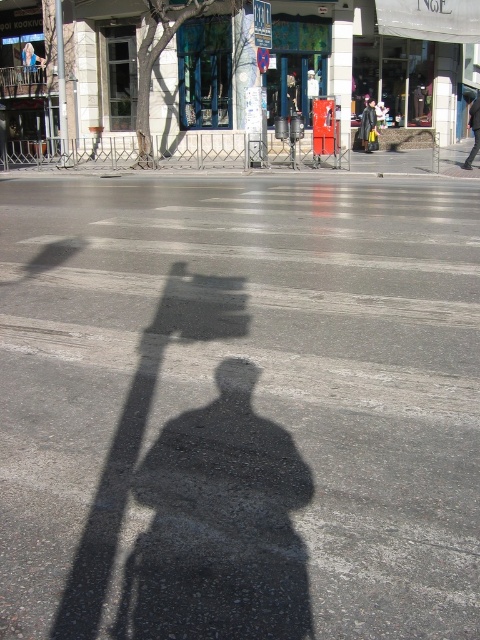
You are a fashion designer observing a model wearing a black leather jacket at center and dark gray pants at center. Which piece of clothing is positioned more to the left?

The black leather jacket at center is positioned more to the left than the dark gray pants at center.

You are a pedestrian trying to cross the street safely. You notice the black shadow at center and the metallic blue street sign at upper center. Which object is closer to the left side of the street?

The black shadow at center is positioned on the left side of the metallic blue street sign at upper center, so it is closer to the left side of the street.